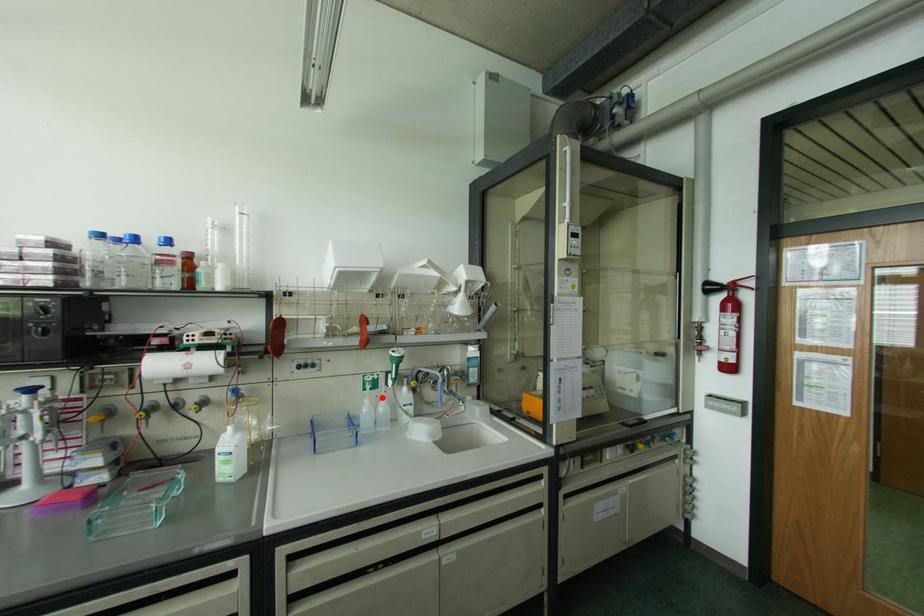
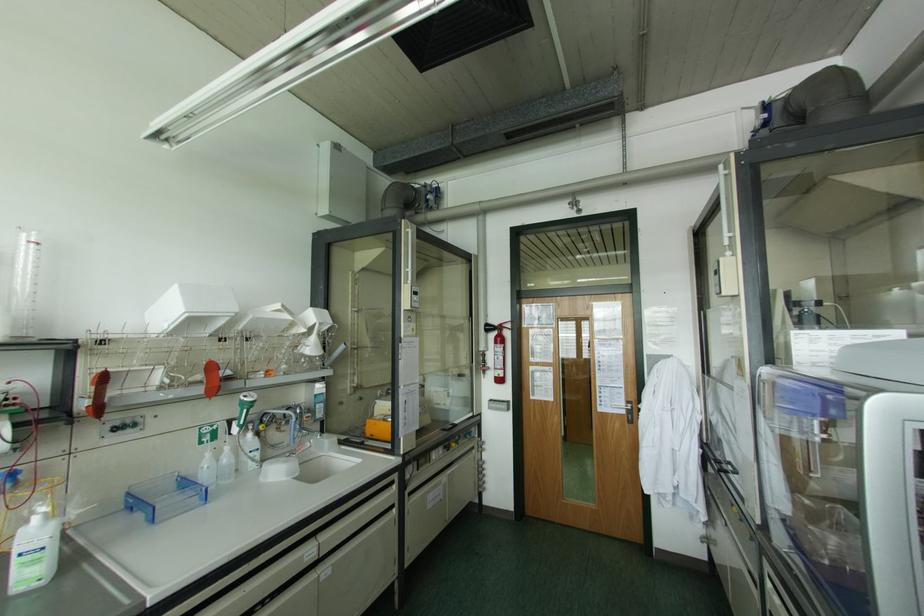
The point at the highlighted location is marked in the first image. Where is the corresponding point in the second image?

(226, 448)